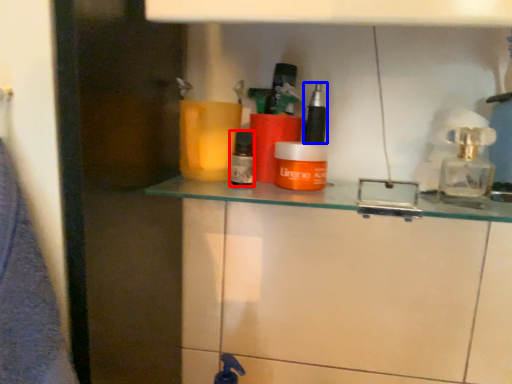
Question: Which of the following is the closest to the observer, toiletry (highlighted by a red box) or toiletry (highlighted by a blue box)?

Choices:
 (A) toiletry
 (B) toiletry

Answer: (A)